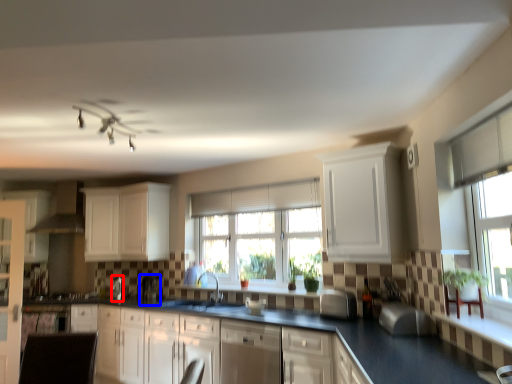
Question: Which point is further to the camera, appliance (highlighted by a red box) or coffee machine (highlighted by a blue box)?

Choices:
 (A) appliance
 (B) coffee machine

Answer: (A)